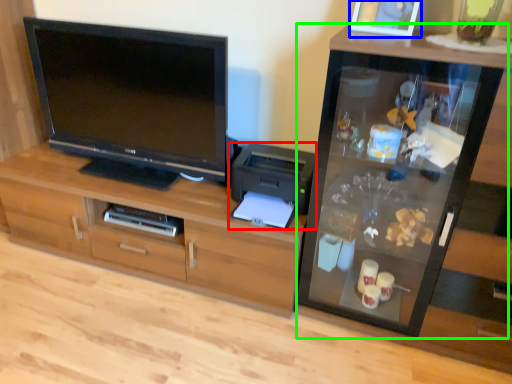
Question: Which is farther away from printer (highlighted by a red box)? picture frame (highlighted by a blue box) or tv cabinet (highlighted by a green box)?

Choices:
 (A) picture frame
 (B) tv cabinet

Answer: (A)